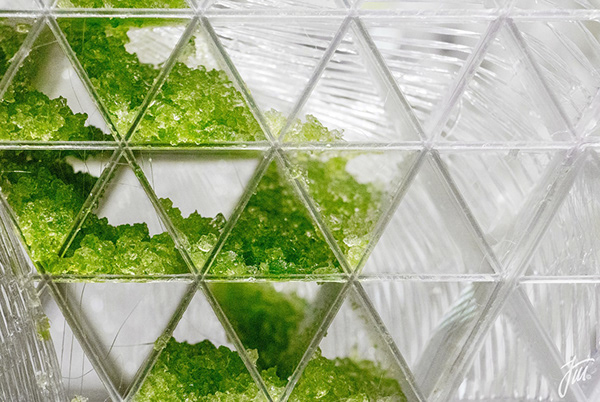
This screenshot has height=402, width=600. I want to click on top horizontal glass panels shown in image, so click(283, 12), click(427, 13), click(561, 15), click(119, 12), click(12, 12).